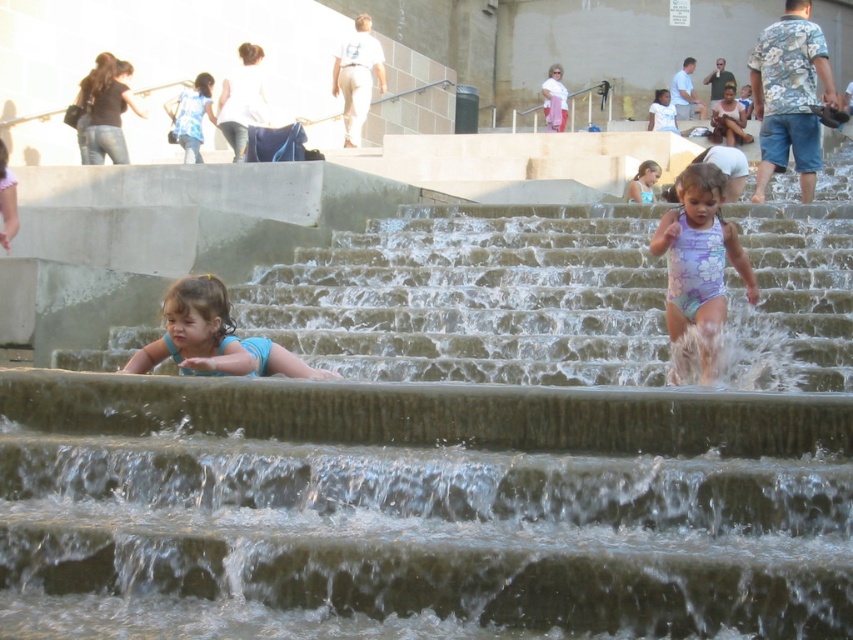
Which is in front, point (183, 93) or point (654, 182)?

Point (654, 182) is in front.

The height and width of the screenshot is (640, 853). Describe the element at coordinates (190, 116) in the screenshot. I see `blue fabric dress at upper center` at that location.

Locate an element on the screen. This screenshot has width=853, height=640. blue fabric dress at upper center is located at coordinates (190, 116).

Can you confirm if smooth concrete stairs at center is bigger than blue fabric swimsuit at lower left?

Indeed, smooth concrete stairs at center has a larger size compared to blue fabric swimsuit at lower left.

Where is `smooth concrete stairs at center`? The width and height of the screenshot is (853, 640). smooth concrete stairs at center is located at coordinates (474, 296).

Locate an element on the screen. The height and width of the screenshot is (640, 853). smooth concrete stairs at center is located at coordinates (474, 296).

Between smooth concrete stairs at center and purple floral swimsuit at right, which one is positioned lower?

purple floral swimsuit at right is below.

Is smooth concrete stairs at center closer to the viewer compared to purple floral swimsuit at right?

Yes.

Between point (339, 355) and point (723, 298), which one is positioned in front?

Point (723, 298)

Image resolution: width=853 pixels, height=640 pixels. What are the coordinates of `smooth concrete stairs at center` in the screenshot? It's located at (474, 296).